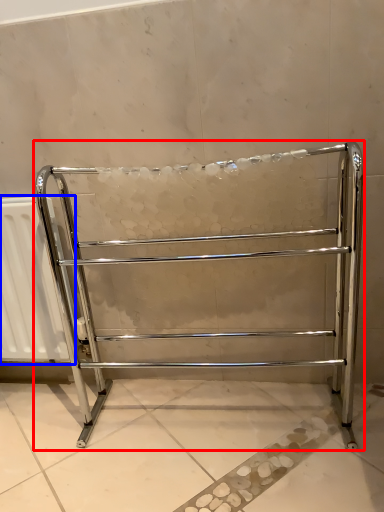
Question: Among these objects, which one is nearest to the camera, furniture (highlighted by a red box) or radiator (highlighted by a blue box)?

Choices:
 (A) furniture
 (B) radiator

Answer: (A)